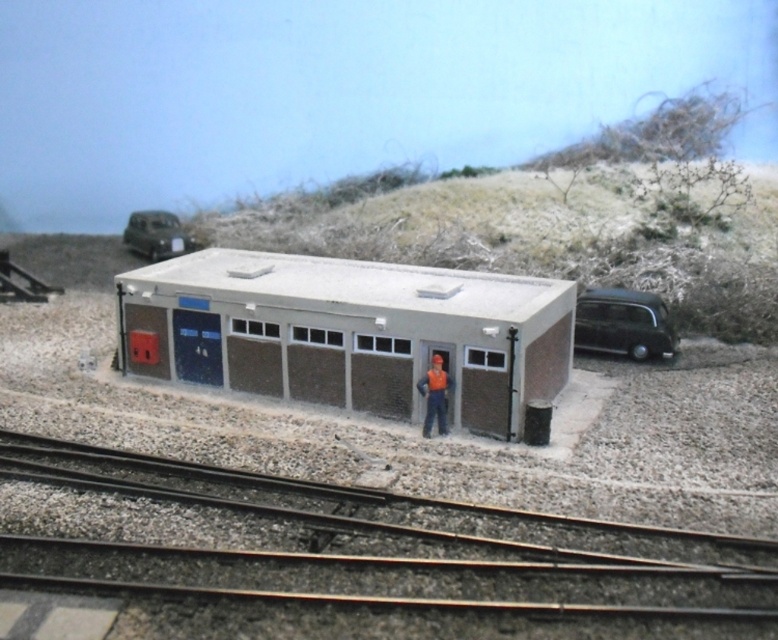
Question: Which point is farther to the camera?

Choices:
 (A) orange fabric worker at center
 (B) metallic green car at upper left

Answer: (B)

Question: Is the position of matte gray shed at center more distant than that of metallic green car at upper left?

Choices:
 (A) yes
 (B) no

Answer: (B)

Question: Which of the following is the closest to the observer?

Choices:
 (A) metallic green car at upper left
 (B) smooth metal tracks at center

Answer: (B)

Question: Does matte gray shed at center appear on the left side of orange fabric worker at center?

Choices:
 (A) no
 (B) yes

Answer: (B)

Question: Which of the following is the closest to the observer?

Choices:
 (A) orange fabric worker at center
 (B) smooth metal tracks at center

Answer: (B)

Question: Can you confirm if smooth metal tracks at center is positioned above orange fabric worker at center?

Choices:
 (A) no
 (B) yes

Answer: (A)